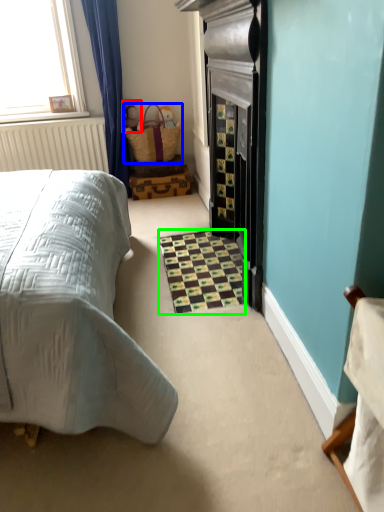
Question: Which object is the closest to the toy (highlighted by a red box)? Choose among these: basket (highlighted by a blue box) or tile (highlighted by a green box).

Choices:
 (A) basket
 (B) tile

Answer: (A)